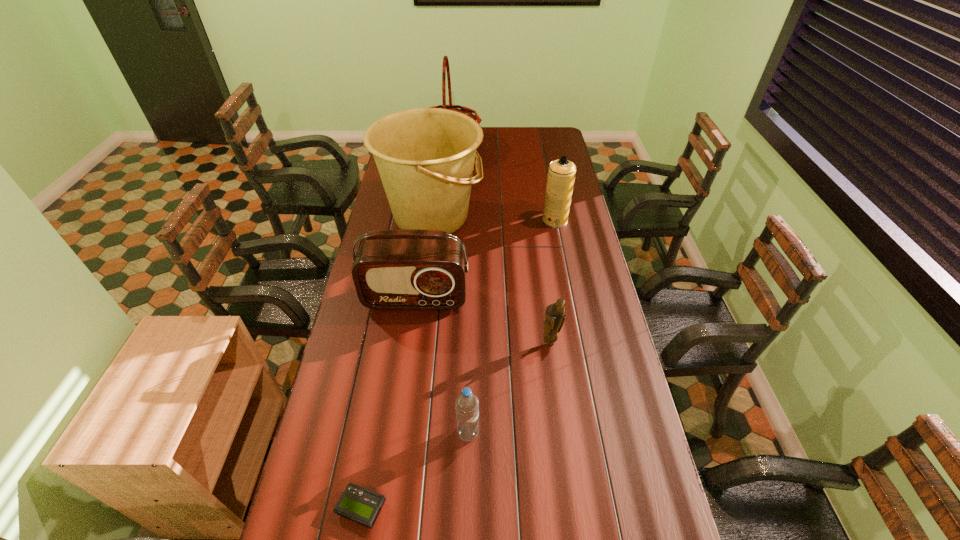
At what (x,y) coordinates should I click in order to perform the action: click on basket. Please return your answer as a coordinate pair (x, y). Looking at the image, I should click on (445, 67).

Locate an element on the screen. The width and height of the screenshot is (960, 540). the second tallest object is located at coordinates 425,157.

Where is `radio receiver`? Image resolution: width=960 pixels, height=540 pixels. radio receiver is located at coordinates (406, 269).

Identify the location of aerosol can. (561, 174).

This screenshot has width=960, height=540. Identify the location of water bottle. (466, 404).

At what (x,y) coordinates should I click in order to perform the action: click on the third nearest object. Please return your answer as a coordinate pair (x, y). Looking at the image, I should click on (555, 317).

Identify the location of figurine. The image size is (960, 540). (555, 317).

The image size is (960, 540). I want to click on the nearest object, so click(x=360, y=505).

Where is `beeper`? beeper is located at coordinates (360, 505).

Identify the location of free region located on the front of the farthest object. The height and width of the screenshot is (540, 960). (446, 173).